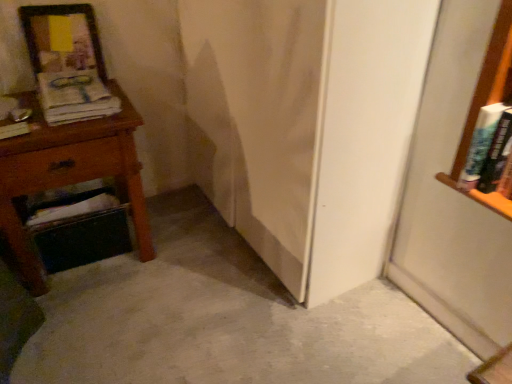
Question: Is hardcover book at right, the 1th book when ordered from right to left, positioned with its back to hardcover book at left, which ranks as the second book in right-to-left order?

Choices:
 (A) yes
 (B) no

Answer: (B)

Question: Is hardcover book at right, the 1th book when ordered from right to left, shorter than hardcover book at left, which ranks as the second book in right-to-left order?

Choices:
 (A) no
 (B) yes

Answer: (A)

Question: Is hardcover book at right, the 1th book when ordered from right to left, further to camera compared to hardcover book at left, placed as the first book when sorted from left to right?

Choices:
 (A) no
 (B) yes

Answer: (A)

Question: Can you confirm if hardcover book at right, the 2th book from the left, is wider than hardcover book at left, placed as the first book when sorted from left to right?

Choices:
 (A) yes
 (B) no

Answer: (A)

Question: Is hardcover book at right, the 2th book from the left, not near hardcover book at left, which ranks as the second book in right-to-left order?

Choices:
 (A) no
 (B) yes

Answer: (B)

Question: From a real-world perspective, is wooden nightstand at left positioned above or below hardcover book at left, placed as the first book when sorted from left to right?

Choices:
 (A) above
 (B) below

Answer: (B)

Question: Is wooden nightstand at left in front of or behind hardcover book at left, which ranks as the second book in right-to-left order, in the image?

Choices:
 (A) behind
 (B) front

Answer: (B)

Question: In terms of width, does wooden nightstand at left look wider or thinner when compared to hardcover book at left, which ranks as the second book in right-to-left order?

Choices:
 (A) wide
 (B) thin

Answer: (A)

Question: From the image's perspective, is wooden nightstand at left positioned above or below hardcover book at left, placed as the first book when sorted from left to right?

Choices:
 (A) below
 (B) above

Answer: (A)

Question: Is matte paper magazine at left bigger or smaller than wooden picture frame at upper left?

Choices:
 (A) small
 (B) big

Answer: (A)

Question: Visually, is matte paper magazine at left positioned to the left or to the right of wooden picture frame at upper left?

Choices:
 (A) right
 (B) left

Answer: (A)

Question: Is matte paper magazine at left taller or shorter than wooden picture frame at upper left?

Choices:
 (A) tall
 (B) short

Answer: (B)

Question: From the image's perspective, is matte paper magazine at left positioned above or below wooden picture frame at upper left?

Choices:
 (A) above
 (B) below

Answer: (B)

Question: Is wooden nightstand at left spatially inside wooden picture frame at upper left, or outside of it?

Choices:
 (A) inside
 (B) outside

Answer: (B)

Question: Is wooden nightstand at left bigger or smaller than wooden picture frame at upper left?

Choices:
 (A) small
 (B) big

Answer: (B)